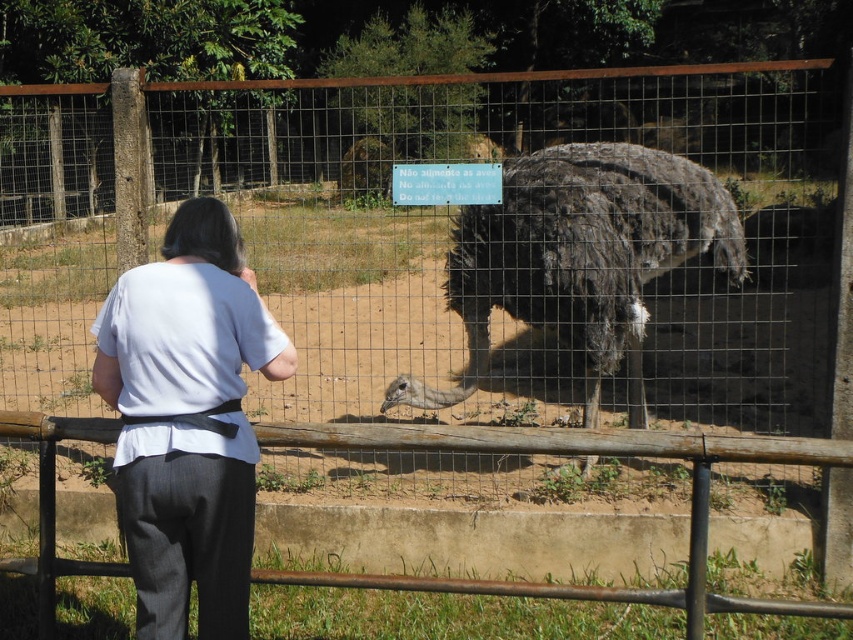
You are a zookeeper who needs to clean the enclosure. You see the white fabric at center and the dark brown feathered ostrich at center. Which object is closer to the ground?

The white fabric at center is located below dark brown feathered ostrich at center, so it is closer to the ground.

You are standing at the zoo and want to take a picture of the dark brown feathered ostrich at center through the rusty metal rail at lower center. Can you see the entire ostrich without any obstruction from the rail?

The dark brown feathered ostrich at center is further to the viewer than the rusty metal rail at lower center, so the rail is closer to you. This means the rail could block part of the ostrich in your photo.

You are a zookeeper standing at the camera position. You need to feed the dark brown feathered ostrich at center. The feeding tool you have can reach up to 5 meters. Can you reach the ostrich with the tool?

The dark brown feathered ostrich at center is 4.76 meters away from the camera, so yes, the feeding tool can reach it since its maximum reach is 5 meters.